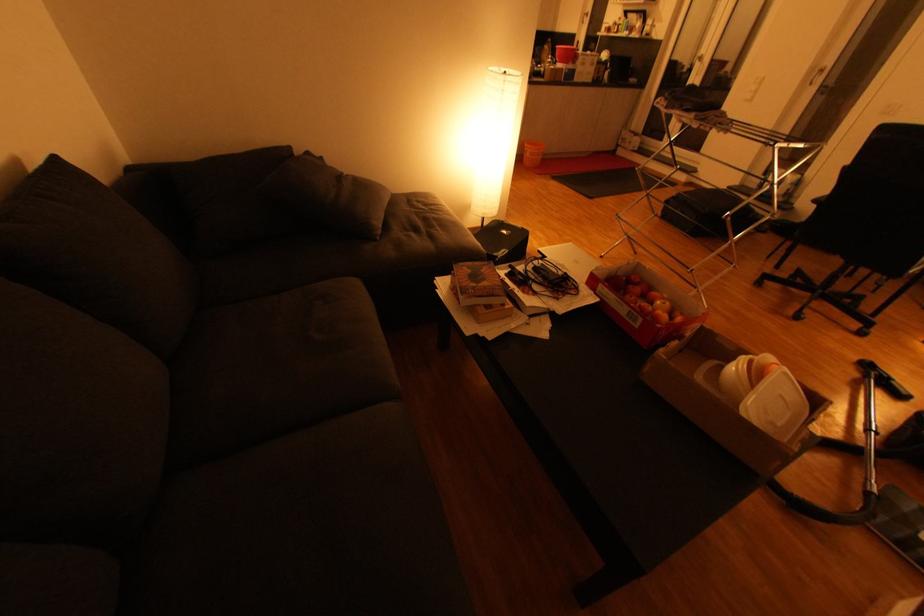
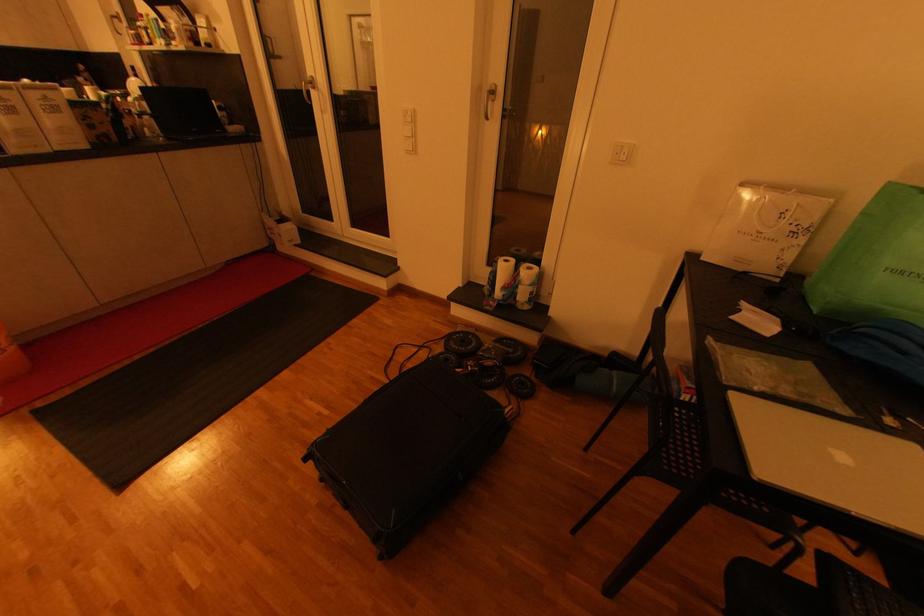
Where in the second image is the point corresponding to point 751,100 from the first image?

(412, 153)